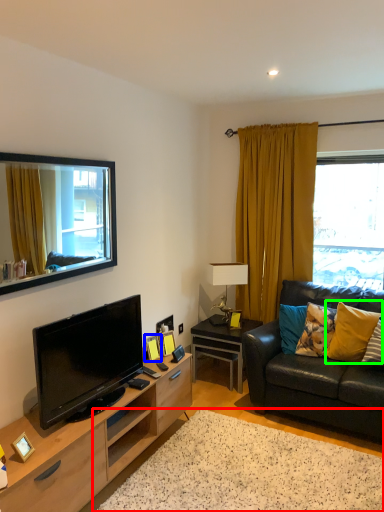
Question: Based on their relative distances, which object is farther from plain (highlighted by a red box)? Choose from picture frame (highlighted by a blue box) and pillow (highlighted by a green box).

Choices:
 (A) picture frame
 (B) pillow

Answer: (B)